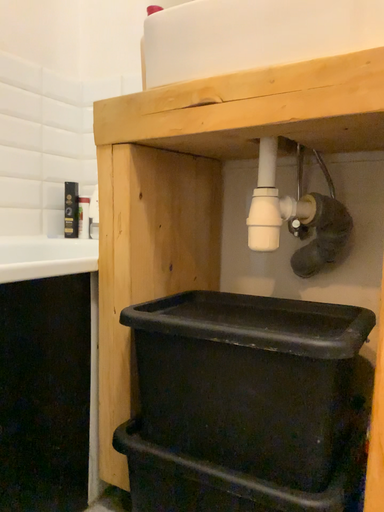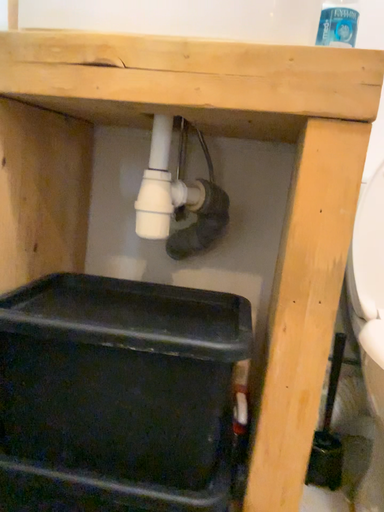
Question: How did the camera likely rotate when shooting the video?

Choices:
 (A) rotated right
 (B) rotated left

Answer: (A)